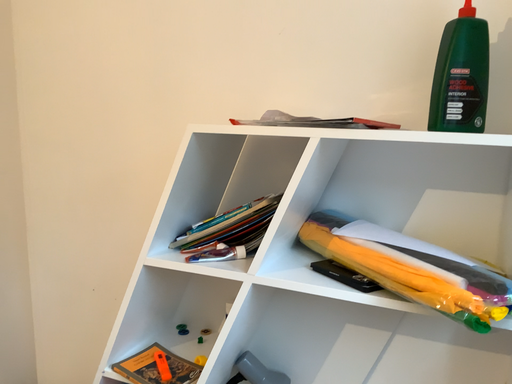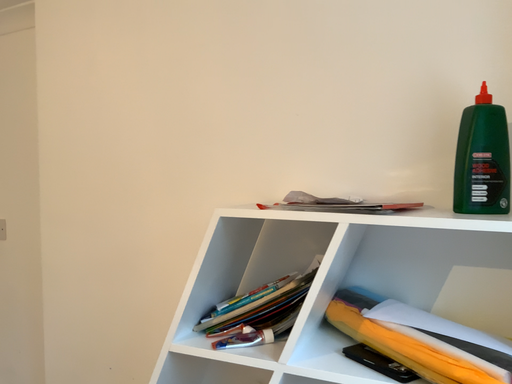
Question: How did the camera likely rotate when shooting the video?

Choices:
 (A) rotated upward
 (B) rotated downward

Answer: (A)